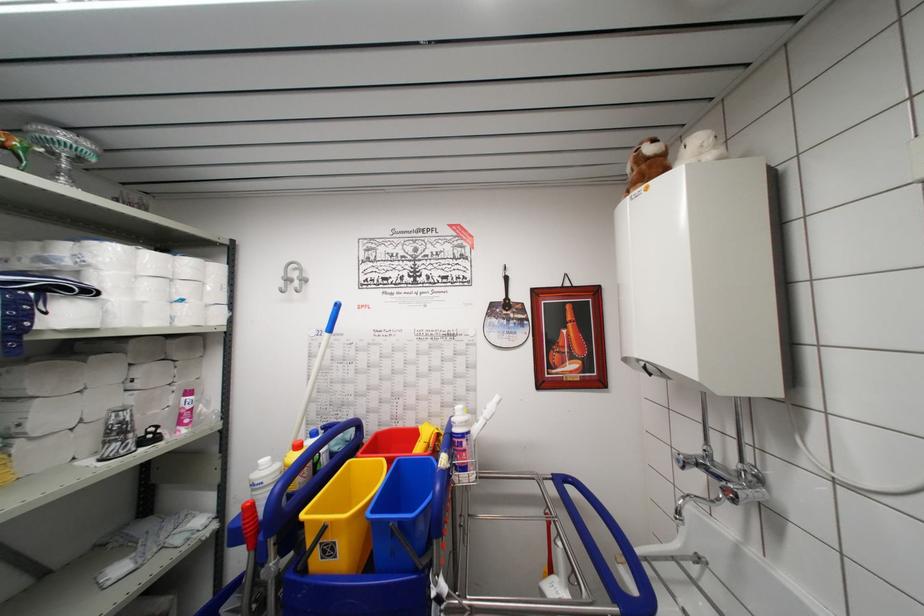
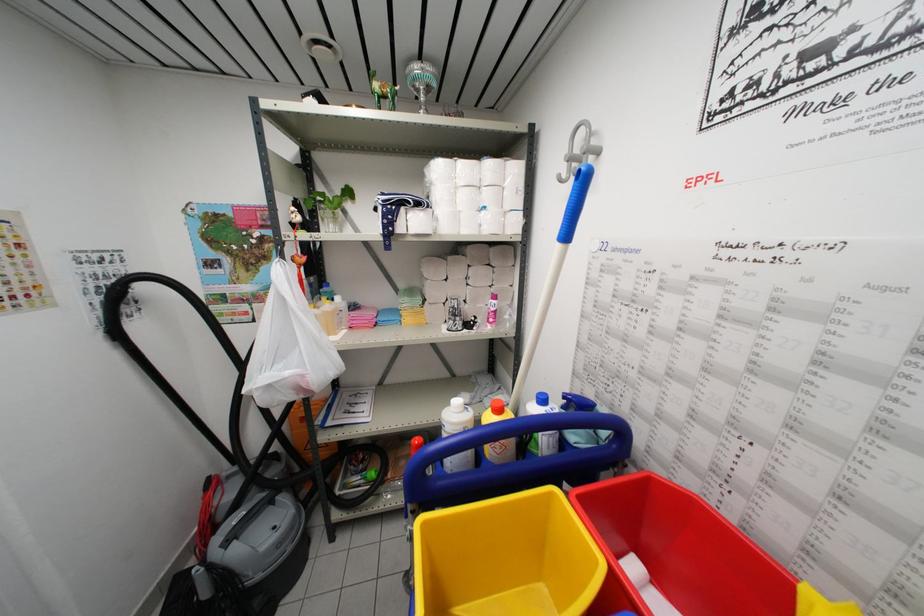
Find the pixel in the second image that matches the point at 307,280 in the first image.

(597, 148)